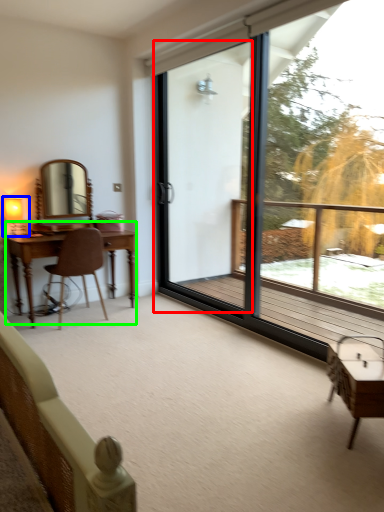
Question: Which is farther away from screen door (highlighted by a red box)? table lamp (highlighted by a blue box) or table (highlighted by a green box)?

Choices:
 (A) table lamp
 (B) table

Answer: (A)